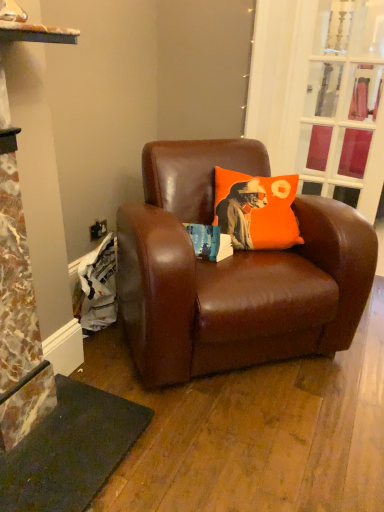
Question: Does clear glass door at upper right have a greater width compared to orange fabric pillow at center?

Choices:
 (A) no
 (B) yes

Answer: (A)

Question: Is clear glass door at upper right positioned far away from orange fabric pillow at center?

Choices:
 (A) no
 (B) yes

Answer: (A)

Question: Is clear glass door at upper right behind orange fabric pillow at center?

Choices:
 (A) yes
 (B) no

Answer: (A)

Question: Does clear glass door at upper right have a larger size compared to orange fabric pillow at center?

Choices:
 (A) yes
 (B) no

Answer: (B)

Question: Is orange fabric pillow at center completely or partially inside clear glass door at upper right?

Choices:
 (A) yes
 (B) no

Answer: (B)

Question: Is point (347, 177) closer or farther from the camera than point (241, 215)?

Choices:
 (A) closer
 (B) farther

Answer: (B)

Question: In the image, is clear glass door at upper right on the left side or the right side of orange fabric pillow at center?

Choices:
 (A) right
 (B) left

Answer: (A)

Question: Is clear glass door at upper right taller or shorter than orange fabric pillow at center?

Choices:
 (A) tall
 (B) short

Answer: (A)

Question: From the image's perspective, is clear glass door at upper right above or below orange fabric pillow at center?

Choices:
 (A) below
 (B) above

Answer: (B)

Question: From the image's perspective, is brown leather chair at center located above or below orange fabric pillow at center?

Choices:
 (A) above
 (B) below

Answer: (B)

Question: Based on their sizes in the image, would you say brown leather chair at center is bigger or smaller than orange fabric pillow at center?

Choices:
 (A) small
 (B) big

Answer: (B)

Question: From a real-world perspective, is brown leather chair at center physically located above or below orange fabric pillow at center?

Choices:
 (A) above
 (B) below

Answer: (B)

Question: Is point (266, 269) positioned closer to the camera than point (289, 241)?

Choices:
 (A) farther
 (B) closer

Answer: (B)

Question: Is point (274, 188) closer or farther from the camera than point (240, 261)?

Choices:
 (A) farther
 (B) closer

Answer: (A)

Question: Looking at their shapes, would you say orange fabric pillow at center is wider or thinner than brown leather chair at center?

Choices:
 (A) wide
 (B) thin

Answer: (B)